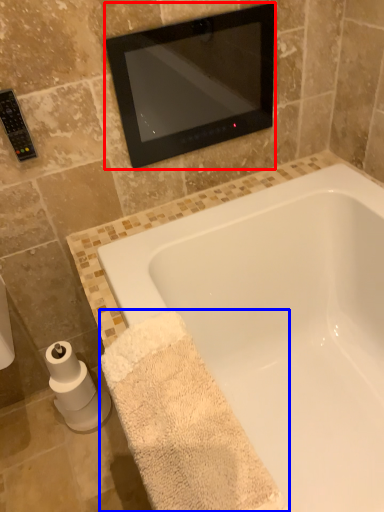
Question: Which point is closer to the camera, mirror (highlighted by a red box) or bath towel (highlighted by a blue box)?

Choices:
 (A) mirror
 (B) bath towel

Answer: (B)